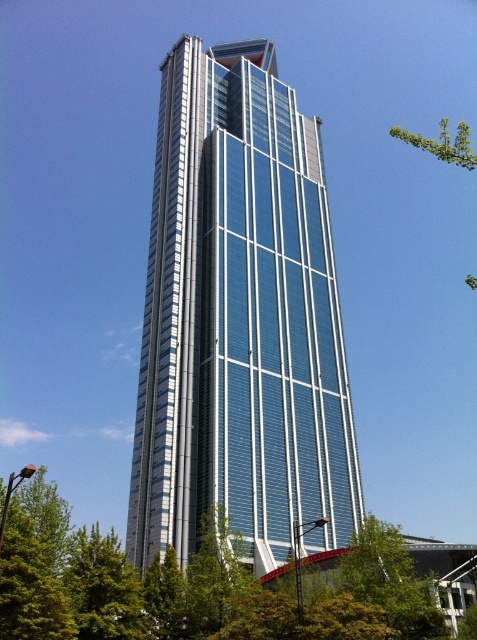
Is point (186, 179) in front of point (425, 576)?

No, it is behind (425, 576).

Is shiny glass tower at center wider than green leafy tree at lower left?

No.

Who is more distant from viewer, (261, 500) or (321, 557)?

The point (261, 500) is more distant.

Locate an element on the screen. Image resolution: width=477 pixels, height=640 pixels. shiny glass tower at center is located at coordinates (x=239, y=320).